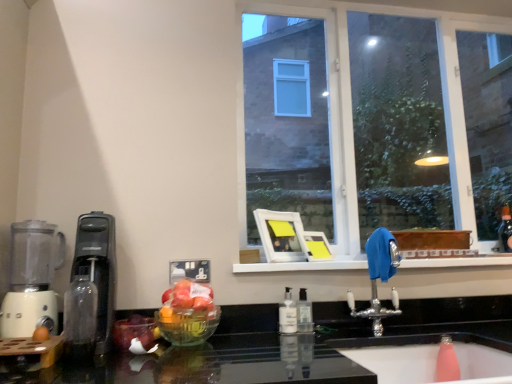
Question: Are transparent glass bottle at left, the first bottle in the front-to-back sequence, and white plastic blender at left beside each other?

Choices:
 (A) yes
 (B) no

Answer: (B)

Question: Is transparent glass bottle at left, the 3th bottle when ordered from back to front, in front of white plastic blender at left?

Choices:
 (A) no
 (B) yes

Answer: (B)

Question: Is transparent glass bottle at left, placed as the 1th bottle when sorted from left to right, to the left of white plastic blender at left from the viewer's perspective?

Choices:
 (A) yes
 (B) no

Answer: (B)

Question: Does transparent glass bottle at left, the 3th bottle when ordered from back to front, have a greater height compared to white plastic blender at left?

Choices:
 (A) no
 (B) yes

Answer: (A)

Question: Is transparent glass bottle at left, the 3th bottle when ordered from back to front, turned away from white plastic blender at left?

Choices:
 (A) no
 (B) yes

Answer: (A)

Question: Considering the relative positions of black plastic coffee machine at left and white plastic blender at left in the image provided, is black plastic coffee machine at left to the left or to the right of white plastic blender at left?

Choices:
 (A) left
 (B) right

Answer: (B)

Question: In terms of width, does black plastic coffee machine at left look wider or thinner when compared to white plastic blender at left?

Choices:
 (A) wide
 (B) thin

Answer: (A)

Question: From a real-world perspective, is black plastic coffee machine at left physically located above or below white plastic blender at left?

Choices:
 (A) above
 (B) below

Answer: (B)

Question: Is black plastic coffee machine at left in front of or behind white plastic blender at left in the image?

Choices:
 (A) front
 (B) behind

Answer: (A)

Question: Considering the relative positions of clear plastic soap dispenser at center, which is the second bottle from back to front, and transparent glass bottle at left, the 3th bottle when ordered from back to front, in the image provided, is clear plastic soap dispenser at center, which is the second bottle from back to front, to the left or to the right of transparent glass bottle at left, the 3th bottle when ordered from back to front,?

Choices:
 (A) right
 (B) left

Answer: (A)

Question: Is clear plastic soap dispenser at center, which is the second bottle from left to right, bigger or smaller than transparent glass bottle at left, the third bottle from the right?

Choices:
 (A) small
 (B) big

Answer: (A)

Question: Is clear plastic soap dispenser at center, marked as the second bottle in a front-to-back arrangement, inside the boundaries of transparent glass bottle at left, the third bottle from the right, or outside?

Choices:
 (A) outside
 (B) inside

Answer: (A)

Question: In terms of width, does clear plastic soap dispenser at center, marked as the second bottle in a front-to-back arrangement, look wider or thinner when compared to transparent glass bottle at left, the first bottle in the front-to-back sequence?

Choices:
 (A) thin
 (B) wide

Answer: (A)

Question: From a real-world perspective, is clear plastic soap dispenser at center, acting as the third bottle starting from the front, physically located above or below clear plastic soap dispenser at center, placed as the second bottle when sorted from right to left?

Choices:
 (A) below
 (B) above

Answer: (A)

Question: From their relative heights in the image, would you say clear plastic soap dispenser at center, the 1th bottle in the back-to-front sequence, is taller or shorter than clear plastic soap dispenser at center, which is the second bottle from left to right?

Choices:
 (A) tall
 (B) short

Answer: (A)